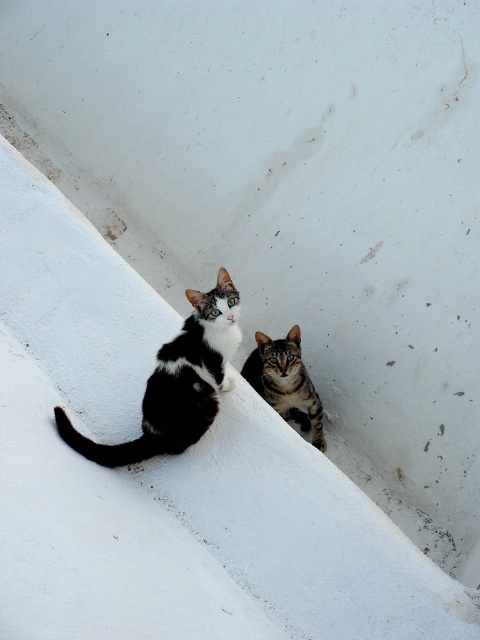
Which of these two, black and white fur cat at center or striped fur cat at center, stands taller?

black and white fur cat at center

What do you see at coordinates (177, 381) in the screenshot? I see `black and white fur cat at center` at bounding box center [177, 381].

Where is `black and white fur cat at center`? The image size is (480, 640). black and white fur cat at center is located at coordinates (177, 381).